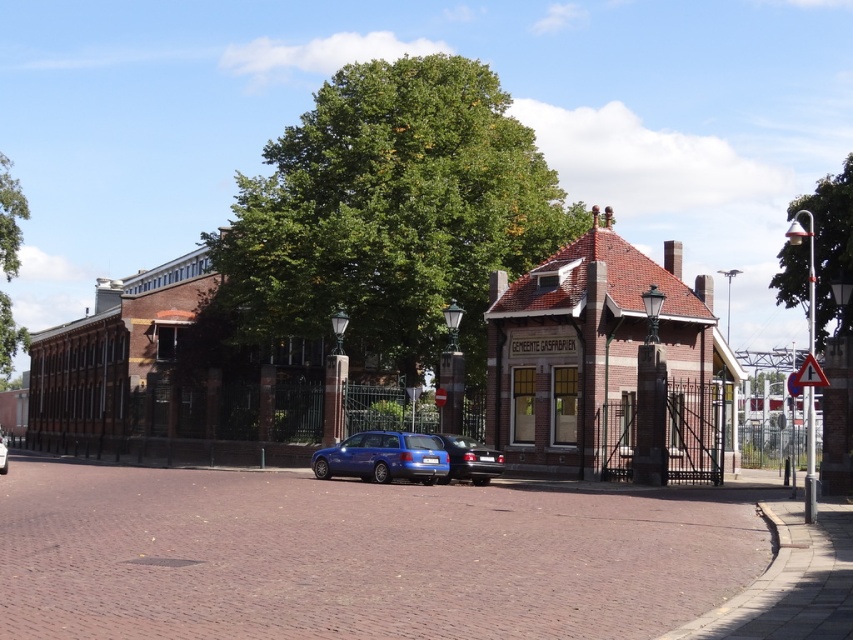
Between matte blue car at center and blue metallic car at center, which one is positioned lower?

Positioned lower is blue metallic car at center.

Based on the photo, which of these two, matte blue car at center or blue metallic car at center, stands taller?

blue metallic car at center is taller.

What do you see at coordinates (383, 458) in the screenshot? I see `matte blue car at center` at bounding box center [383, 458].

I want to click on matte blue car at center, so click(x=383, y=458).

Does green leafy tree at upper right have a smaller size compared to matte blue car at center?

No, green leafy tree at upper right is not smaller than matte blue car at center.

Identify the location of green leafy tree at upper right. (830, 246).

Is point (480, 70) closer to camera compared to point (7, 250)?

Yes, it is.

Is point (360, 83) farther from camera compared to point (24, 349)?

That is False.

Image resolution: width=853 pixels, height=640 pixels. In order to click on green leafy tree at center in this screenshot , I will do `click(392, 209)`.